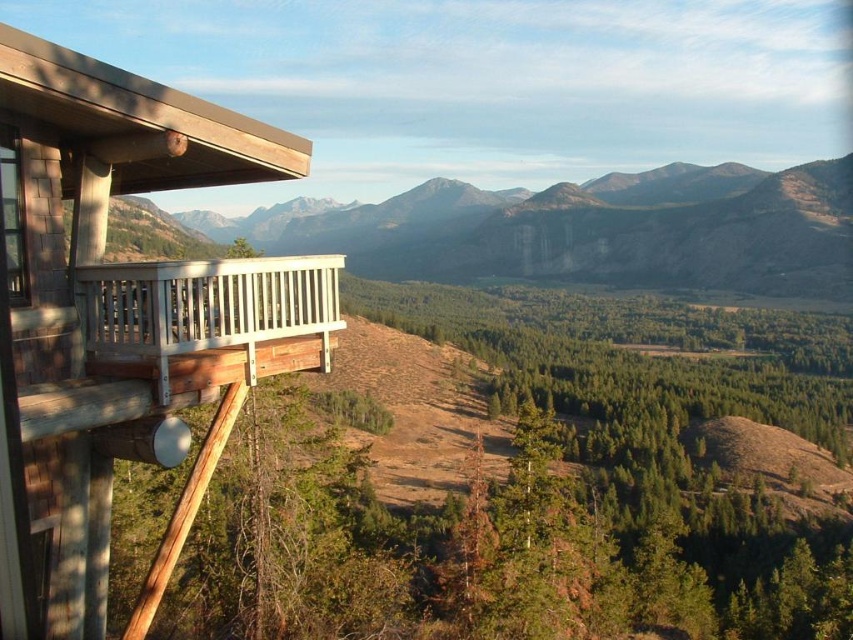
Question: Which object appears closest to the camera in this image?

Choices:
 (A) white wood balcony at upper left
 (B) wooden cabin at left

Answer: (B)

Question: Does wooden cabin at left have a greater width compared to white wood balcony at upper left?

Choices:
 (A) no
 (B) yes

Answer: (A)

Question: Can you confirm if wooden cabin at left is thinner than white wood balcony at upper left?

Choices:
 (A) no
 (B) yes

Answer: (B)

Question: Does wooden cabin at left lie behind white wood balcony at upper left?

Choices:
 (A) no
 (B) yes

Answer: (A)

Question: Which object is closer to the camera taking this photo?

Choices:
 (A) white wood balcony at upper left
 (B) wooden cabin at left

Answer: (B)